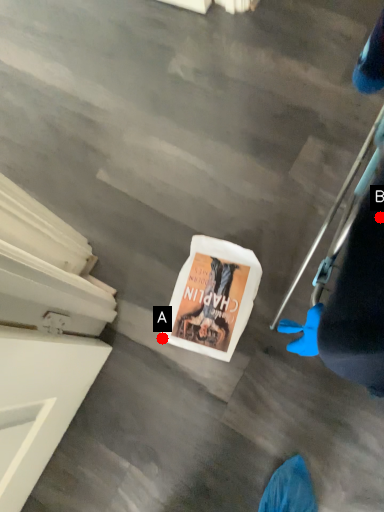
Question: Two points are circled on the image, labeled by A and B beside each circle. Which of the following is the farthest from the observer?

Choices:
 (A) A is further
 (B) B is further

Answer: (A)